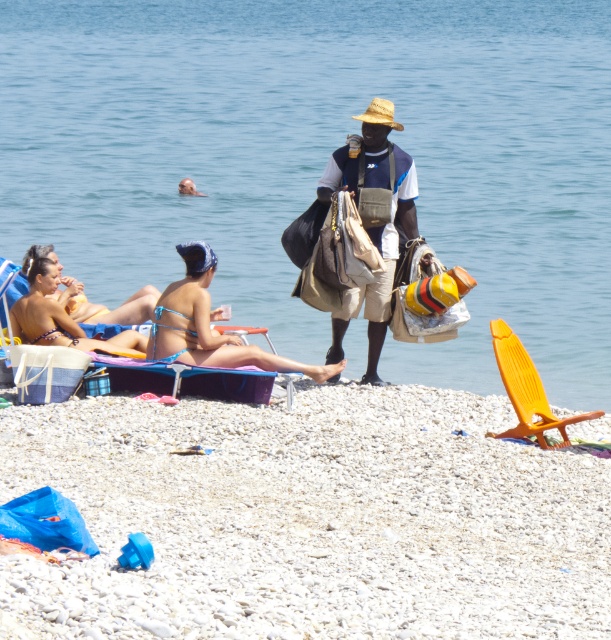
You are a beachgoer who wants to swim in the clear blue water at center. However, you need to pass by the blue fabric beach chair at lower left. Based on their positions, which direction should you move to reach the water?

Since the clear blue water at center is positioned on the right side of the blue fabric beach chair at lower left, you should move to the right to reach the water from the chair.

You are a photographer trying to capture the blue woven beach chair at upper left and the smooth brown seal at upper center in the same frame. Based on their positions, which object should you focus on first to ensure both are in the shot?

The blue woven beach chair at upper left is located below the smooth brown seal at upper center, so you should focus on the smooth brown seal at upper center first to ensure both are in the shot.

You are a photographer trying to capture both the matte bikini at center and the yellow bikini at center in a single frame. Considering their sizes, which bikini should you focus on first to ensure both are clearly visible in the photo?

The matte bikini at center has a larger size compared to yellow bikini at center. To ensure both are clearly visible, focus on the matte bikini at center first, then adjust the camera to include the smaller yellow bikini at center in the frame.